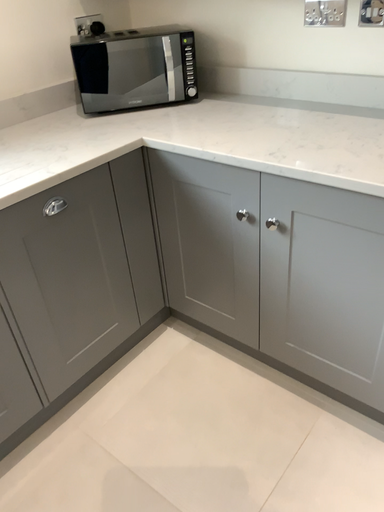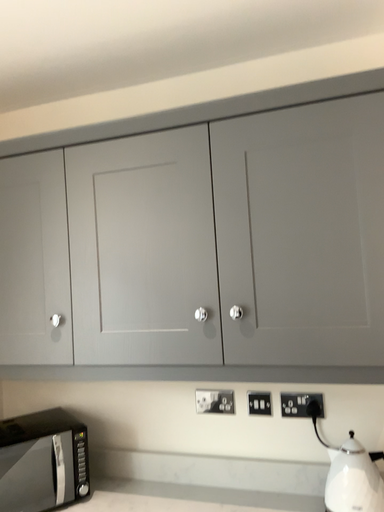
Question: Which way did the camera rotate in the video?

Choices:
 (A) rotated downward
 (B) rotated upward

Answer: (B)